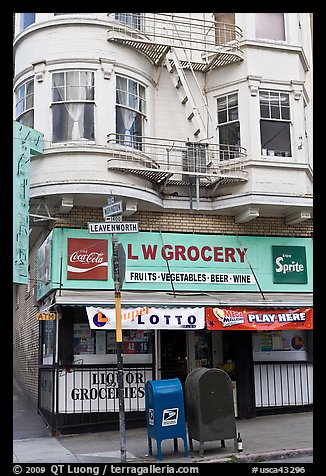
Find the location of a particular element. The width and height of the screenshot is (326, 476). bottle is located at coordinates (240, 440).